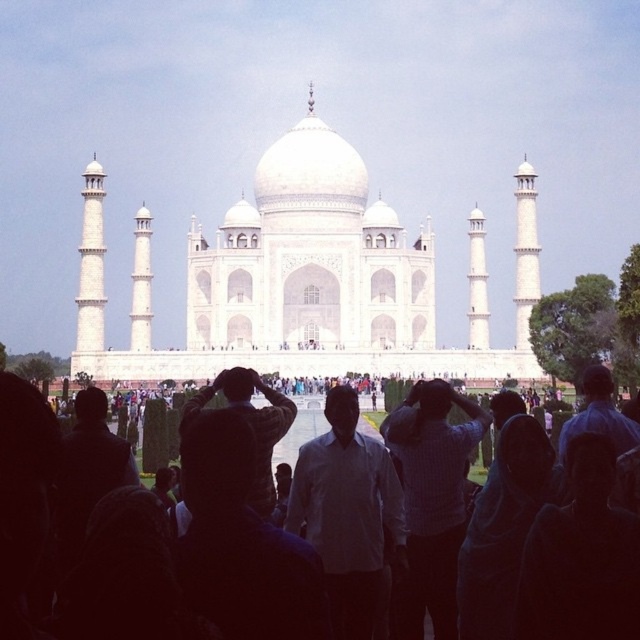
You are standing at the point with coordinates point (45, 525) and want to take a photo of the Taj Mahal. There is an obstruction at point (308, 244). Will this obstruction block your view of the Taj Mahal?

Point (308, 244) is behind point (45, 525), so the obstruction at point (308, 244) will not block your view of the Taj Mahal.

You are standing in the foreground of the Taj Mahal scene and want to take a photo that includes both the white marble Taj Mahal at center and the crowd of people in the foreground. Based on their positions, will the Taj Mahall be in the background or foreground of the photo?

The white marble Taj Mahal at center is located at point 0.480 on the vertical axis, which places it further back compared to the crowd in the foreground. Therefore, the Taj Mahal will be in the background of the photo.

You are standing in front of the Taj Mahal and see the white marble taj mahal at center and the white textured shirt at center. Which object is closer to you?

The white textured shirt at center is closer to you because the white marble taj mahal at center is positioned over it, indicating that the shirt is in front.